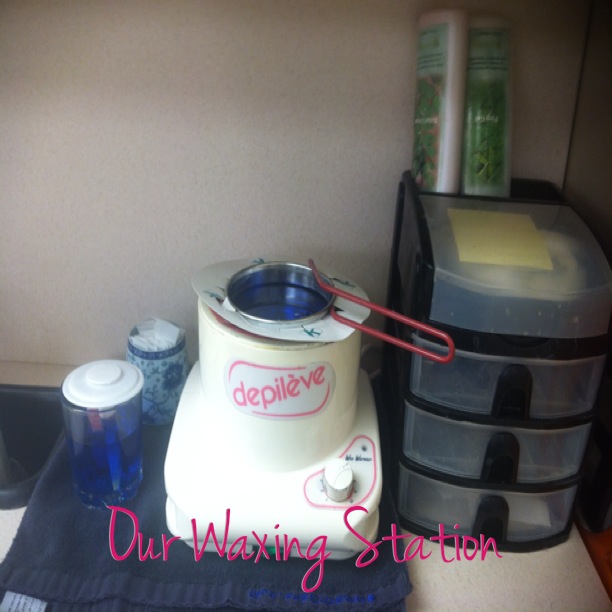
At what (x,y) coordinates should I click in order to perform the action: click on sink. Please return your answer as a coordinate pair (x, y). The image size is (612, 612). Looking at the image, I should click on (23, 423).